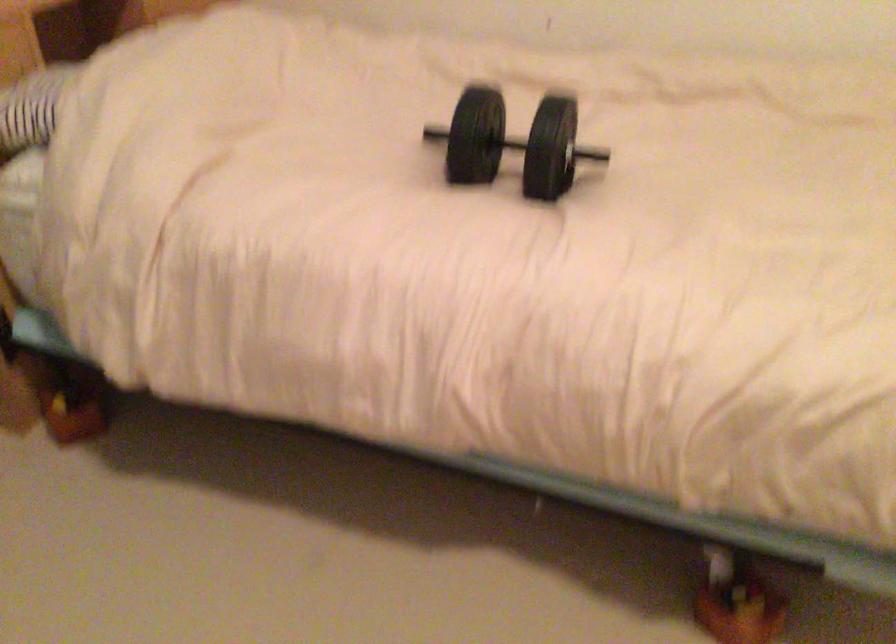
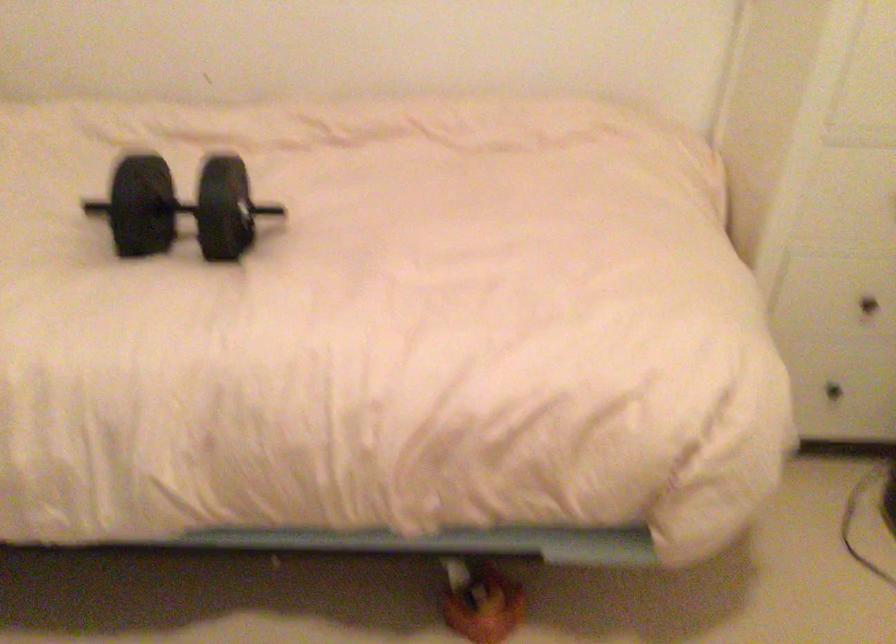
Question: Which direction would the cameraman need to move to produce the second image? Reply with the corresponding letter.

Choices:
 (A) Left
 (B) Right
 (C) Forward
 (D) Backward

Answer: (B)